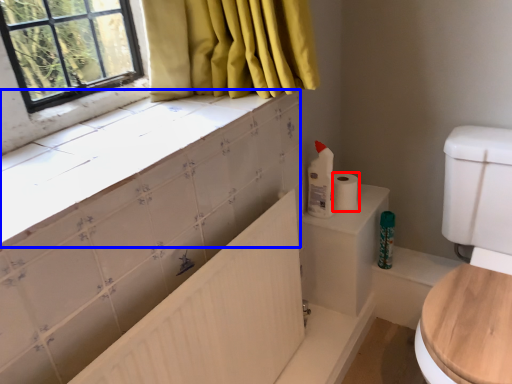
Question: Which of the following is the farthest to the observer, toilet paper (highlighted by a red box) or counter top (highlighted by a blue box)?

Choices:
 (A) toilet paper
 (B) counter top

Answer: (A)